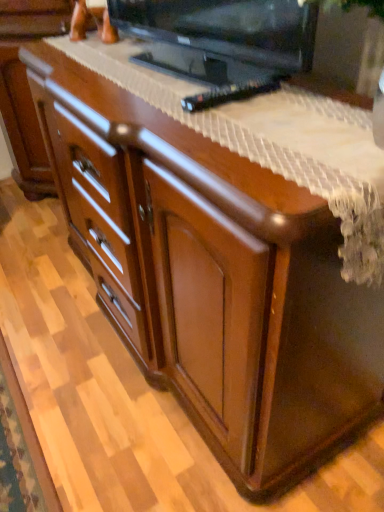
The height and width of the screenshot is (512, 384). I want to click on vacant area located to the right-hand side of black plastic remote at center, so click(296, 100).